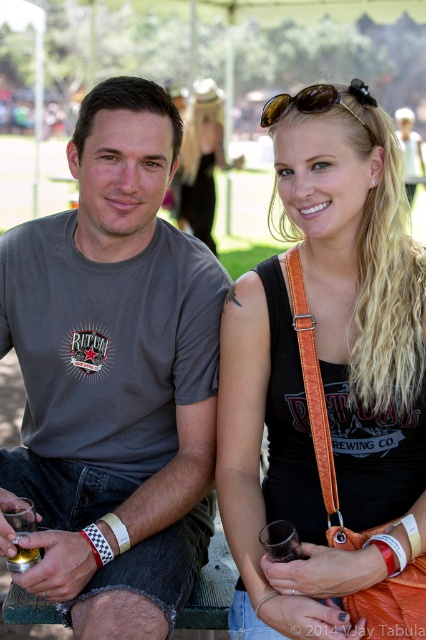
You are a photographer at the event and need to decide which item to focus on for a closeup shot. Since the orange leather strap at center and the brown matte sunglasses at upper center are both in the frame, which one would require a closer focus to capture details due to its size?

The orange leather strap at center is larger in size than the brown matte sunglasses at upper center, so you would need to focus closer on the orange leather strap at center to capture its details.